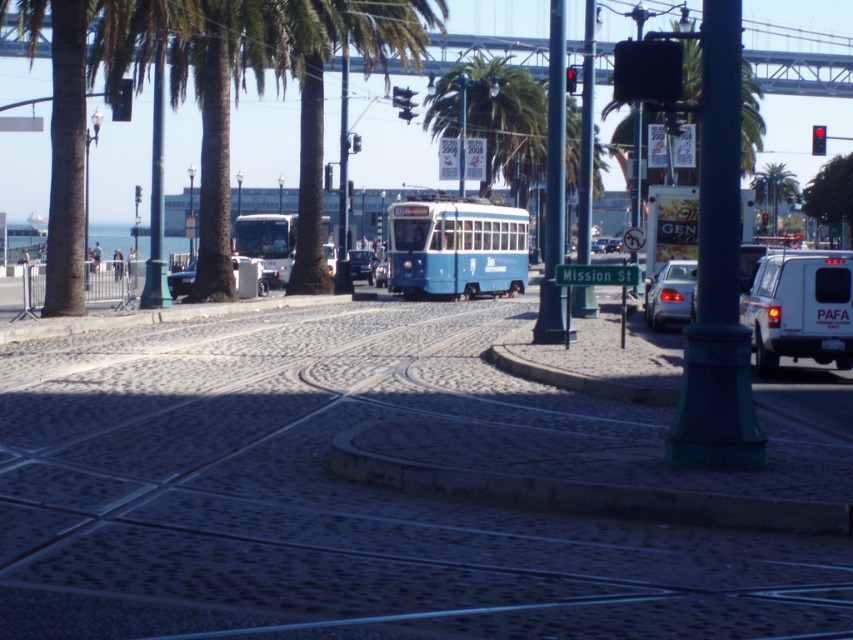
You are a delivery person trying to park your van between the metallic silver car at center and the metallic silver sedan at center. Given that your van is 2.5 meters wide, can you fit it in the space between them?

The metallic silver car at center is wider than the metallic silver sedan at center, but the exact width difference isn

You are a delivery robot with a 1.2 meter wide package. You need to move from the cobblestone train track at center to the red glass traffic light at upper center. Can you fit through the space between them?

The distance between the cobblestone train track at center and the red glass traffic light at upper center is 11.60 meters, which is wider than the 1.2 meter wide package. Therefore, the delivery robot can fit through the space between them.

Consider the image. You are a pedestrian standing on the cobblestone street. You see the cobblestone train track at center and the red glass traffic light at upper center. Which object is closer to you?

The cobblestone train track at center is in front of the red glass traffic light at upper center, so the cobblestone train track at center is closer to you.